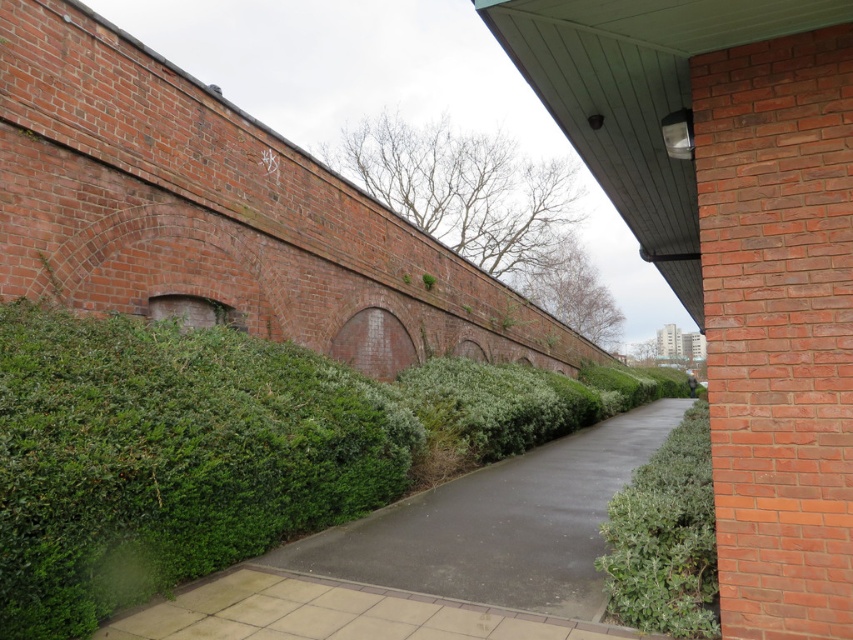
Describe the element at coordinates (502, 524) in the screenshot. This screenshot has height=640, width=853. I see `green asphalt pavement at center` at that location.

Is green asphalt pavement at center smaller than green leafy hedge at right?

No, green asphalt pavement at center is not smaller than green leafy hedge at right.

Find the location of a particular element. green asphalt pavement at center is located at coordinates (502, 524).